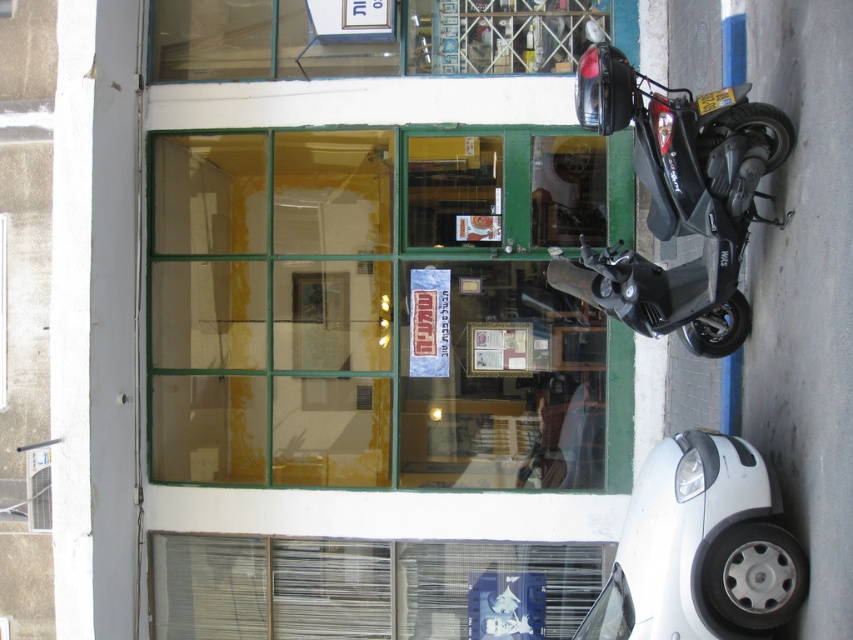
You are standing at the point marked as point [367,314]. What object is exactly at your current location?

The green glass shop window at center is located at point [367,314].

You are a delivery person trying to park your motorcycle between the green glass shop window at center and the matte black scooter at right. Can your motorcycle fit vertically between them if the motorcycle is 1.2 meters wide?

The green glass shop window at center is taller than the matte black scooter at right, but the question is about width. Since the motorcycle is 1.2 meters wide and the space between them isnanot specified in the description, we cannot determine if it will fit. The description only mentions height comparison.

You are a delivery person who needs to park your scooter between the green glass shop window at center and the white matte car at lower right. Is there enough space for your scooter to fit between them?

The green glass shop window at center is positioned over the white matte car at lower right, meaning they are vertically aligned rather than horizontally. Since the scooter needs to be parked horizontally between them, there isnnt enough space because the window is above the car, not beside it.